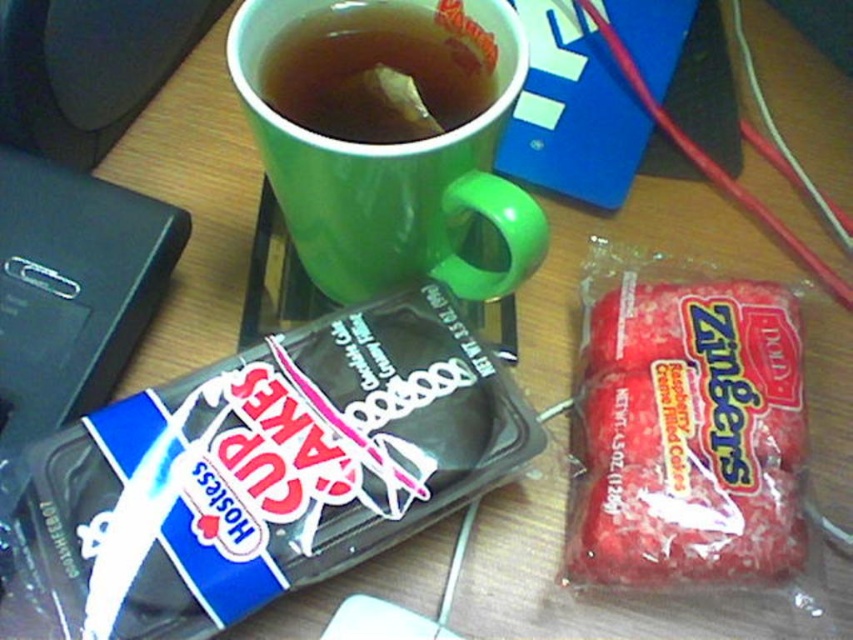
Is blue plastic cupcake at lower left above green matte cup at upper center?

No, blue plastic cupcake at lower left is not above green matte cup at upper center.

Who is lower down, blue plastic cupcake at lower left or green matte cup at upper center?

blue plastic cupcake at lower left is lower down.

Measure the distance between point [192,493] and camera.

16.47 inches

Where is `blue plastic cupcake at lower left`? This screenshot has height=640, width=853. blue plastic cupcake at lower left is located at coordinates (262, 472).

The width and height of the screenshot is (853, 640). I want to click on blue plastic cupcake at lower left, so click(x=262, y=472).

In the scene shown: Is blue plastic cupcake at lower left above green matte mug at upper center?

Incorrect, blue plastic cupcake at lower left is not positioned above green matte mug at upper center.

Is point (445, 312) behind point (376, 276)?

No, (445, 312) is closer to viewer.

At what (x,y) coordinates should I click in order to perform the action: click on blue plastic cupcake at lower left. Please return your answer as a coordinate pair (x, y). This screenshot has height=640, width=853. Looking at the image, I should click on (262, 472).

Between green matte mug at upper center and green matte cup at upper center, which one has more height?

green matte mug at upper center

Does point (489, 218) come behind point (341, 13)?

That is False.

Where is `green matte mug at upper center`? Image resolution: width=853 pixels, height=640 pixels. green matte mug at upper center is located at coordinates (390, 173).